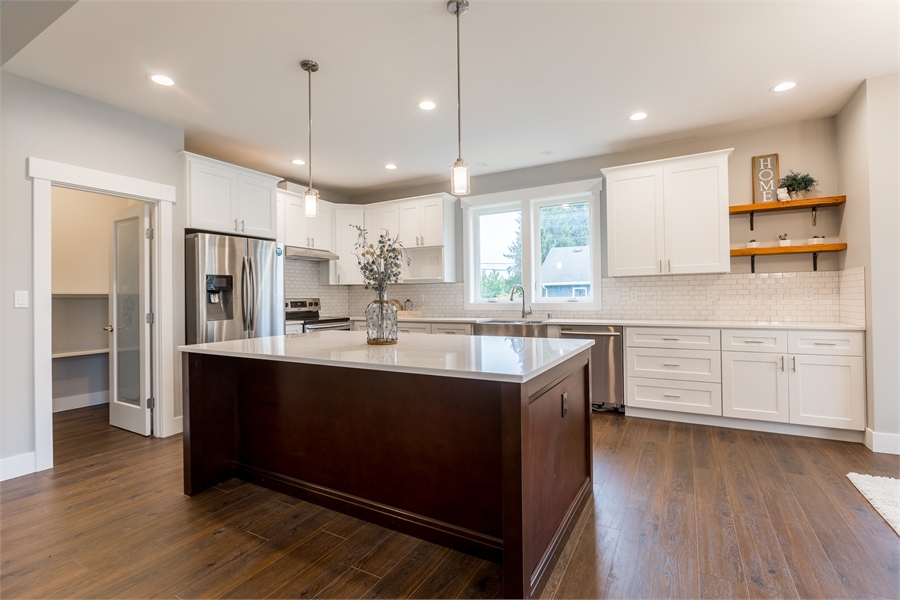
Image resolution: width=900 pixels, height=600 pixels. Identify the location of light. (163, 89), (290, 164), (310, 208), (457, 182), (392, 167), (434, 103), (644, 120), (792, 90).